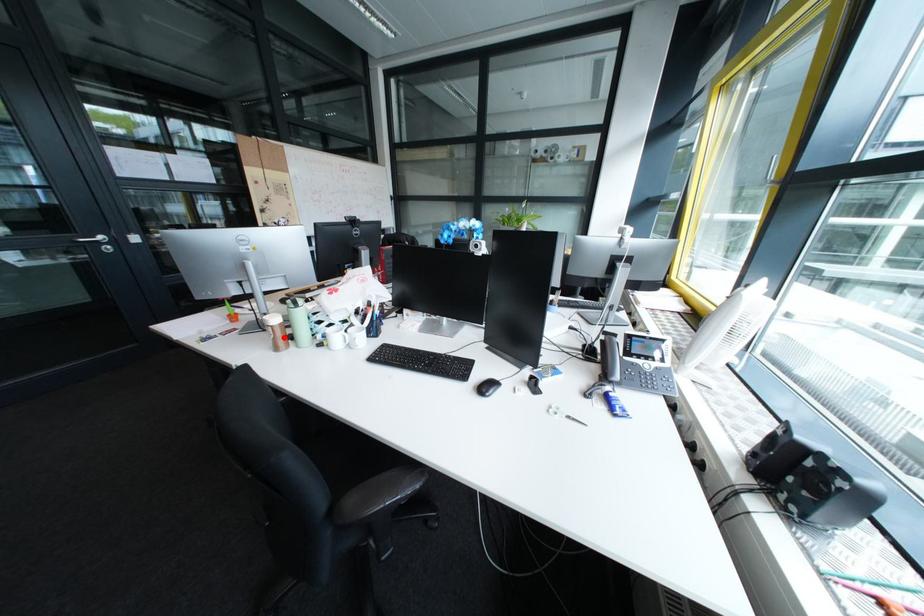
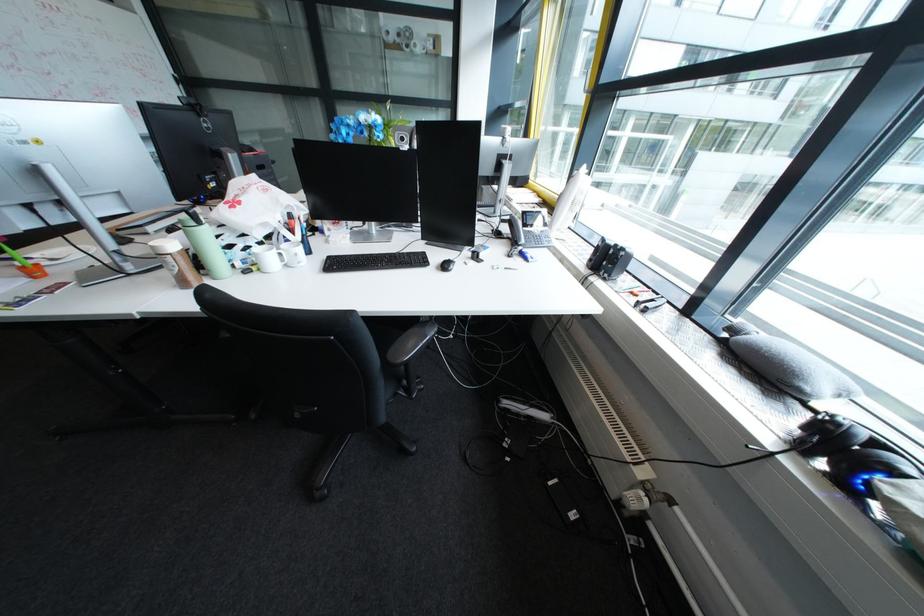
The point at the highlighted location is marked in the first image. Where is the corresponding point in the second image?

(187, 270)